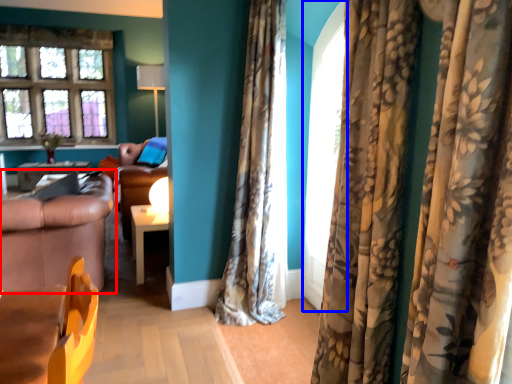
Question: Among these objects, which one is farthest to the camera, studio couch (highlighted by a red box) or screen door (highlighted by a blue box)?

Choices:
 (A) studio couch
 (B) screen door

Answer: (A)